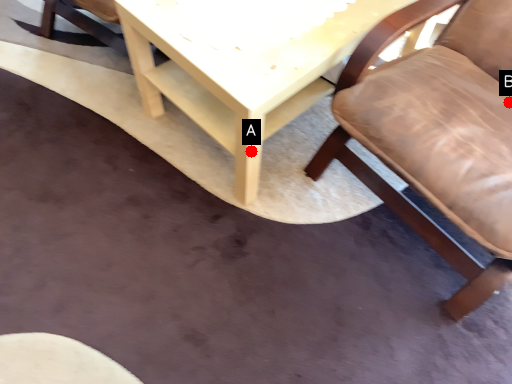
Question: Two points are circled on the image, labeled by A and B beside each circle. Among these points, which one is farthest from the camera?

Choices:
 (A) A is further
 (B) B is further

Answer: (A)